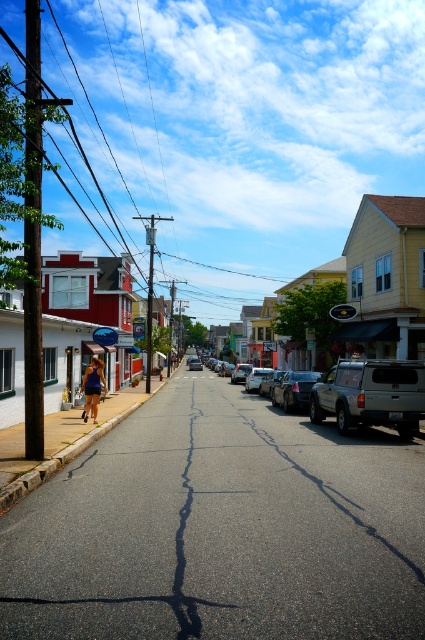
Question: Is silver metallic suv at center-right to the left of metallic silver car at center from the viewer's perspective?

Choices:
 (A) no
 (B) yes

Answer: (A)

Question: Is silver metallic suv at center-right smaller than matte blue shorts at center?

Choices:
 (A) yes
 (B) no

Answer: (A)

Question: Estimate the real-world distances between objects in this image. Which object is closer to the matte blue shorts at center?

Choices:
 (A) silver metallic suv at center-right
 (B) metallic silver car at center

Answer: (B)

Question: Is silver metallic suv at center-right further to camera compared to matte blue shorts at center?

Choices:
 (A) no
 (B) yes

Answer: (A)

Question: Among these objects, which one is farthest from the camera?

Choices:
 (A) matte blue shorts at center
 (B) metallic silver car at center
 (C) silver metallic suv at center
 (D) silver metallic suv at center-right

Answer: (B)

Question: Among these points, which one is farthest from the camera?

Choices:
 (A) (405, 406)
 (B) (274, 387)

Answer: (B)